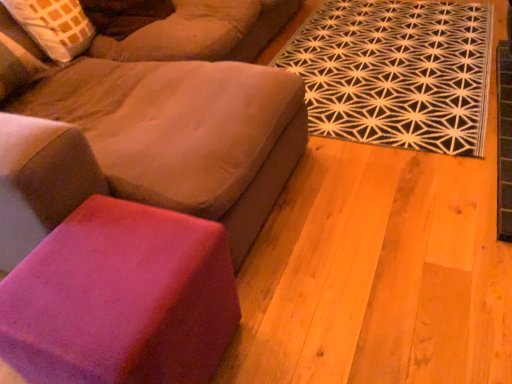
Question: From the image's perspective, is black geometric rug at upper right above or below purple suede stool at lower left?

Choices:
 (A) below
 (B) above

Answer: (B)

Question: Looking at their shapes, would you say black geometric rug at upper right is wider or thinner than purple suede stool at lower left?

Choices:
 (A) thin
 (B) wide

Answer: (B)

Question: Which is nearer to the purple suede stool at lower left?

Choices:
 (A) suede-like beige studio couch at upper left
 (B) black geometric rug at upper right

Answer: (A)

Question: Which is farther from the black geometric rug at upper right?

Choices:
 (A) purple suede stool at lower left
 (B) suede-like beige studio couch at upper left

Answer: (A)